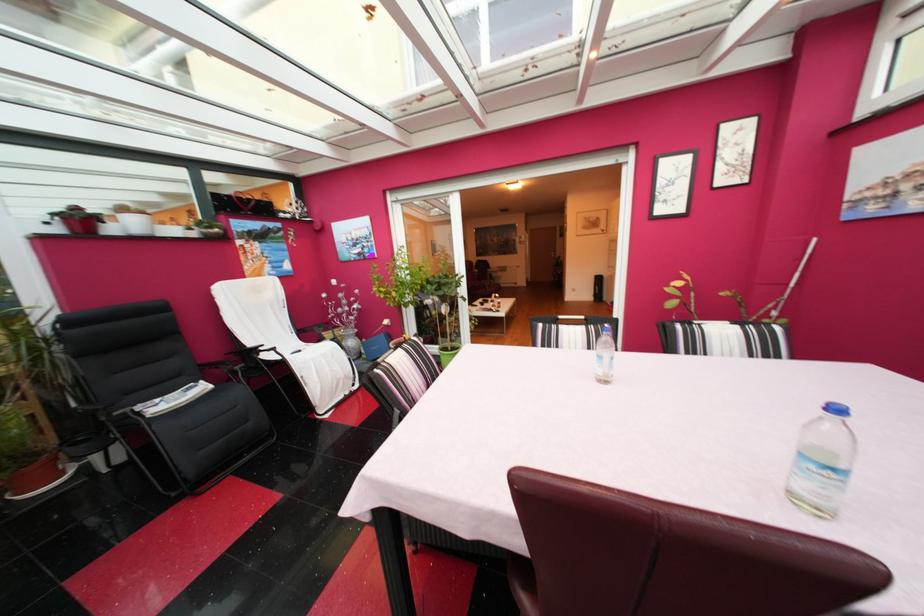
What do you see at coordinates (176, 399) in the screenshot? I see `the black chair sitting surface` at bounding box center [176, 399].